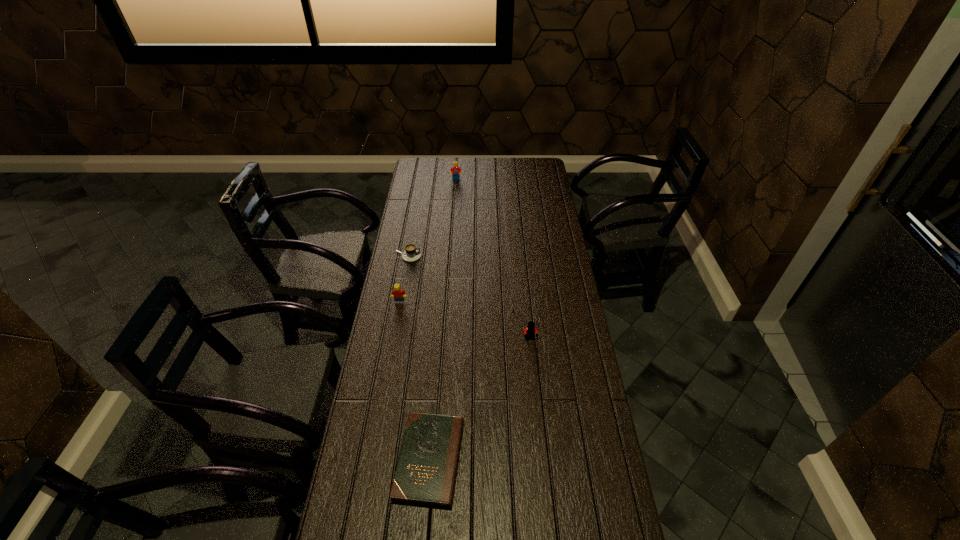
Locate an element on the screen. The height and width of the screenshot is (540, 960). free space located 0.380m on the face of the farthest Lego is located at coordinates [x=453, y=223].

Locate an element on the screen. vacant region located 0.190m on the front-facing side of the second nearest Lego is located at coordinates (393, 342).

Find the location of a particular element. The width and height of the screenshot is (960, 540). vacant area situated on the front-facing side of the second nearest object is located at coordinates click(x=540, y=429).

What are the coordinates of `vacant position located 0.270m with the handle on the side of the second farthest object` in the screenshot? It's located at (481, 256).

Where is `vacant point located 0.100m on the back of the Bible`? The image size is (960, 540). vacant point located 0.100m on the back of the Bible is located at coordinates (436, 390).

The image size is (960, 540). In order to click on object situated at the far edge in this screenshot , I will do `click(455, 171)`.

In order to click on Lego present at the left edge in this screenshot , I will do `click(398, 294)`.

Identify the location of cappuccino present at the left edge. The width and height of the screenshot is (960, 540). (412, 253).

Identify the location of Bible situated at the left edge. (425, 475).

What are the coordinates of `vacant space at the far edge of the desktop` in the screenshot? It's located at (478, 165).